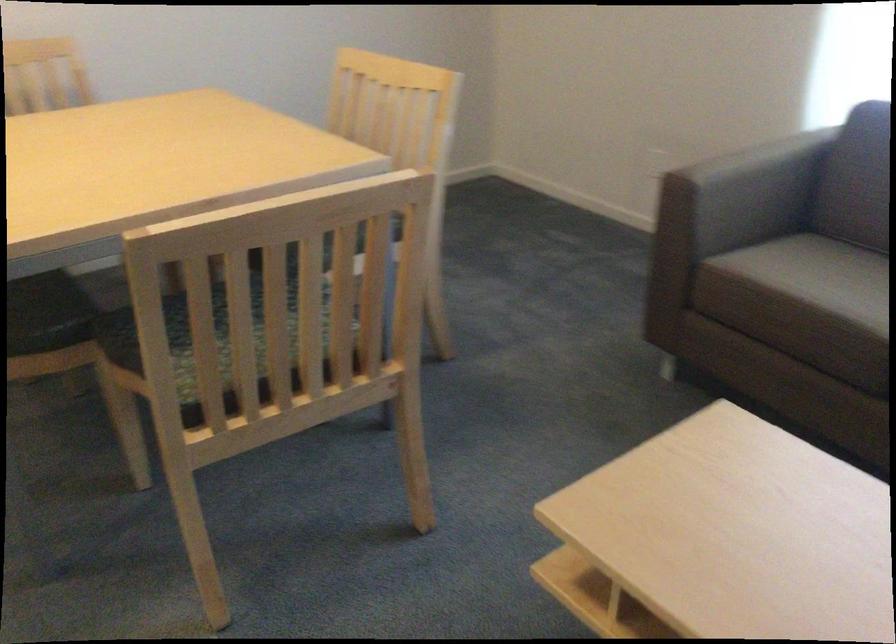
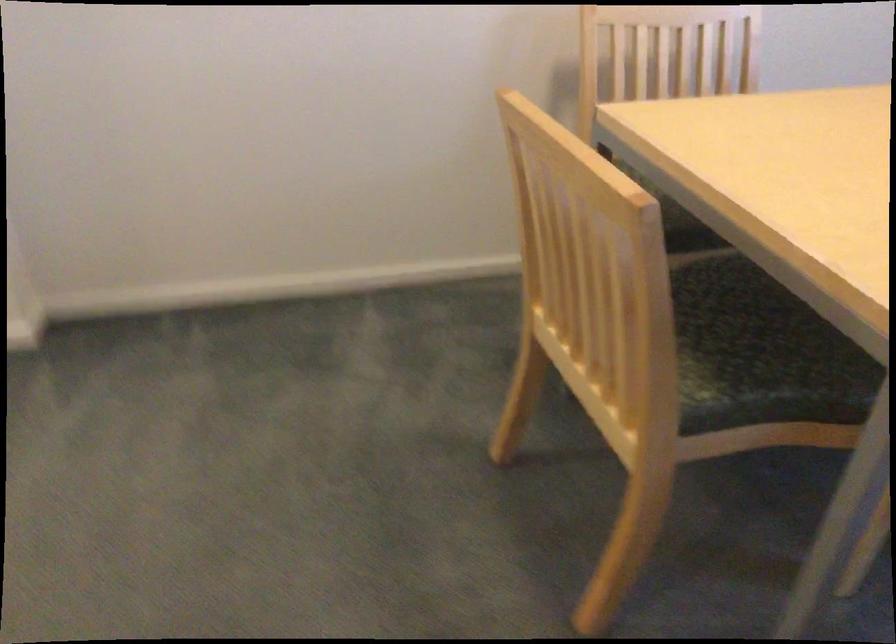
Question: In a continuous first-person perspective shot, in which direction is the camera moving?

Choices:
 (A) Left
 (B) Right
 (C) Forward
 (D) Backward

Answer: (A)